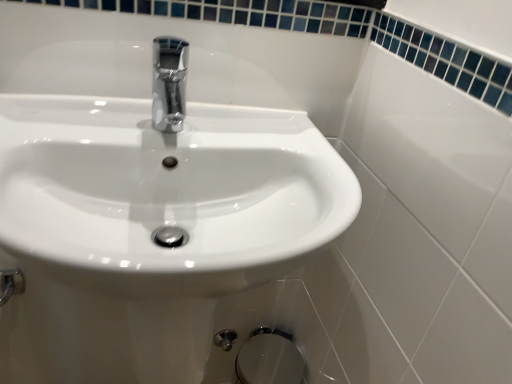
Question: Is white glossy sink at center located outside chrome metallic faucet at center?

Choices:
 (A) yes
 (B) no

Answer: (A)

Question: From the image's perspective, is white glossy sink at center on chrome metallic faucet at center?

Choices:
 (A) no
 (B) yes

Answer: (A)

Question: Can you see white glossy sink at center touching chrome metallic faucet at center?

Choices:
 (A) yes
 (B) no

Answer: (B)

Question: Does white glossy sink at center lie behind chrome metallic faucet at center?

Choices:
 (A) no
 (B) yes

Answer: (A)

Question: Considering the relative sizes of white glossy sink at center and chrome metallic faucet at center in the image provided, is white glossy sink at center taller than chrome metallic faucet at center?

Choices:
 (A) no
 (B) yes

Answer: (B)

Question: Is white glossy sink at center situated inside satin chrome bidet at lower center or outside?

Choices:
 (A) inside
 (B) outside

Answer: (B)

Question: From a real-world perspective, is white glossy sink at center positioned above or below satin chrome bidet at lower center?

Choices:
 (A) below
 (B) above

Answer: (B)

Question: Is point (60, 228) closer or farther from the camera than point (237, 364)?

Choices:
 (A) closer
 (B) farther

Answer: (A)

Question: Relative to satin chrome bidet at lower center, is white glossy sink at center in front or behind?

Choices:
 (A) front
 (B) behind

Answer: (A)

Question: Relative to satin chrome bidet at lower center, is chrome metallic faucet at center in front or behind?

Choices:
 (A) front
 (B) behind

Answer: (A)

Question: From the image's perspective, relative to satin chrome bidet at lower center, is chrome metallic faucet at center above or below?

Choices:
 (A) above
 (B) below

Answer: (A)

Question: Is chrome metallic faucet at center to the left or to the right of satin chrome bidet at lower center in the image?

Choices:
 (A) right
 (B) left

Answer: (B)

Question: In terms of height, does chrome metallic faucet at center look taller or shorter compared to satin chrome bidet at lower center?

Choices:
 (A) short
 (B) tall

Answer: (A)

Question: Based on their sizes in the image, would you say white glossy sink at center is bigger or smaller than chrome metallic faucet at center?

Choices:
 (A) small
 (B) big

Answer: (B)

Question: Is point (104, 167) positioned closer to the camera than point (166, 82)?

Choices:
 (A) farther
 (B) closer

Answer: (B)